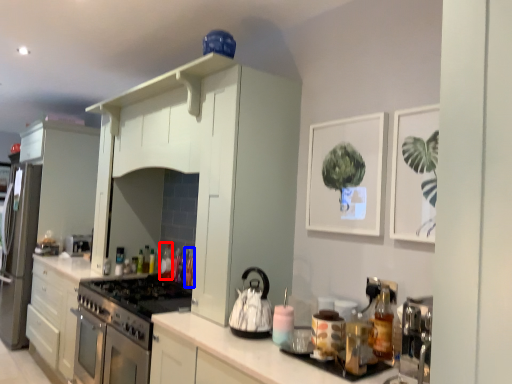
Question: Which point is closer to the camera, bottle (highlighted by a red box) or bottle (highlighted by a blue box)?

Choices:
 (A) bottle
 (B) bottle

Answer: (B)